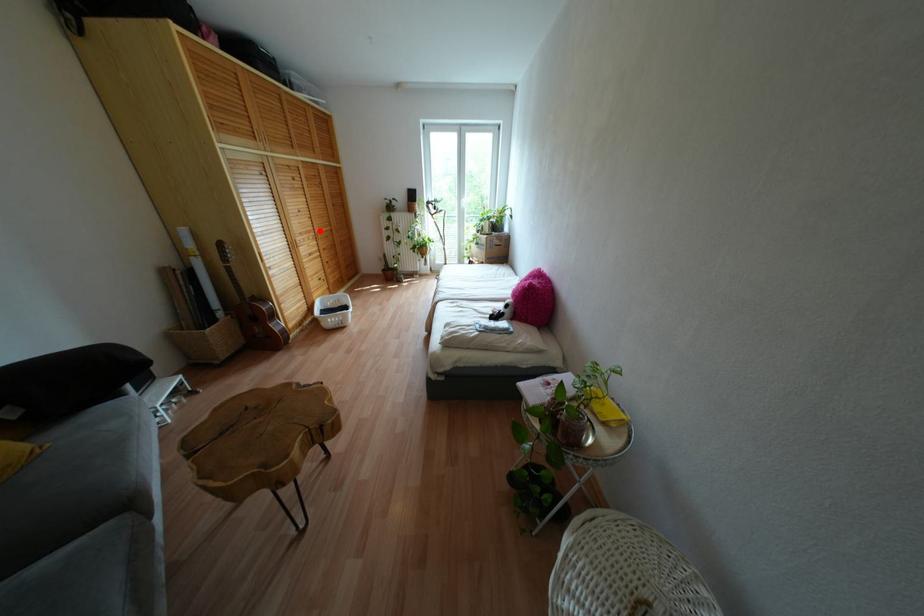
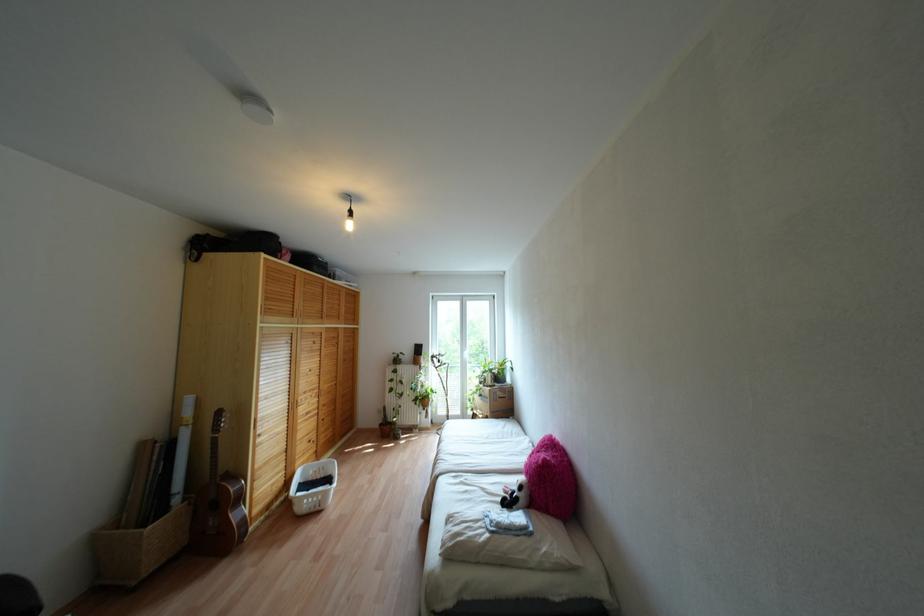
Question: I am providing you with two images of the same scene from different viewpoints. Given a red point in image1, look at the same physical point in image2. Is it:

Choices:
 (A) Closer to the viewpoint
 (B) Farther from the viewpoint

Answer: (B)